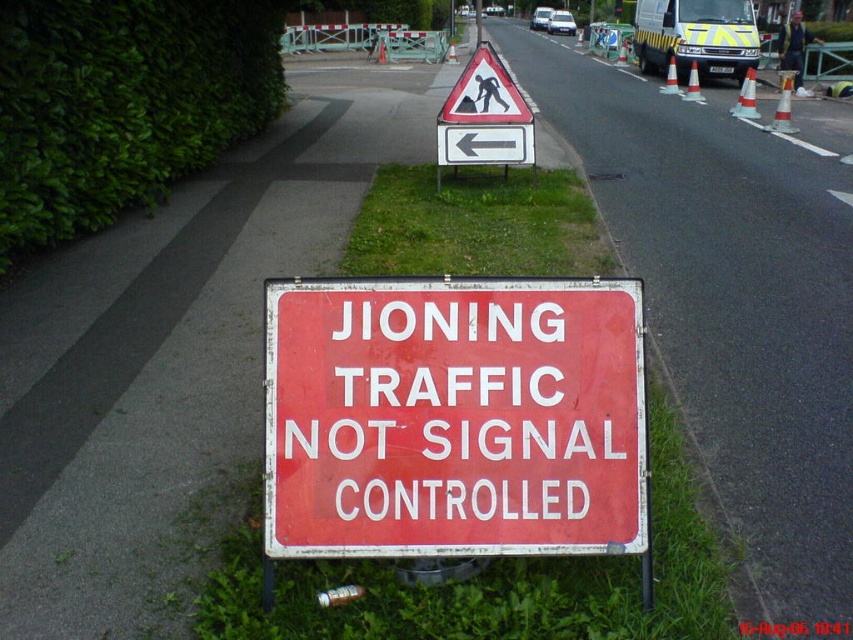
You are driving a car and see the red metal sign at center and the yellow striped van at upper center. Which object is positioned higher in the image?

The yellow striped van at upper center is positioned higher in the image than the red metal sign at center.

You are a delivery driver approaching the red metal sign at center and the green grass at lower center. Based on their sizes, which one do you think is more likely to be a traffic sign?

The red metal sign at center is bigger than green grass at lower center, so it is more likely to be the traffic sign as it is larger and more prominent.

You are standing at the point labeled point (679, 525) and want to walk towards the red and white road sign. Which direction should you move relative to point (566, 451)?

You should move towards point (566, 451) because it is closer to the red and white road sign than point (679, 525).